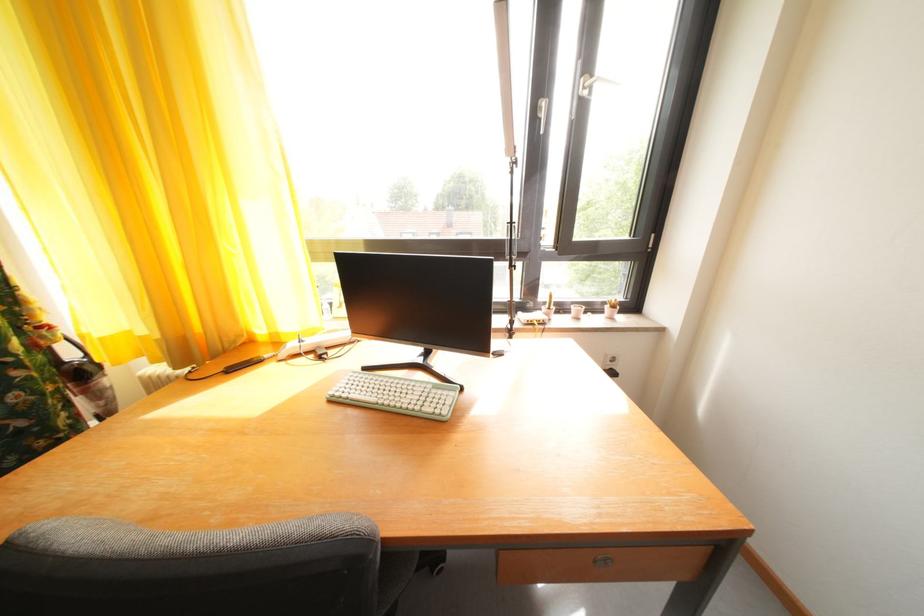
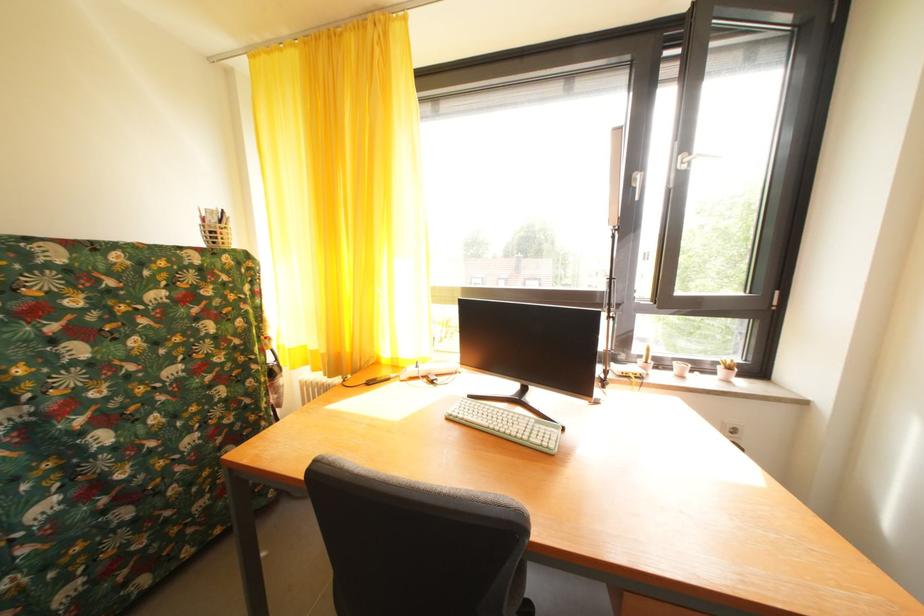
Question: The camera is either moving clockwise (left) or counter-clockwise (right) around the object. The first image is from the beginning of the video and the second image is from the end. Is the camera moving left or right when shooting the video?

Choices:
 (A) Left
 (B) Right

Answer: (B)